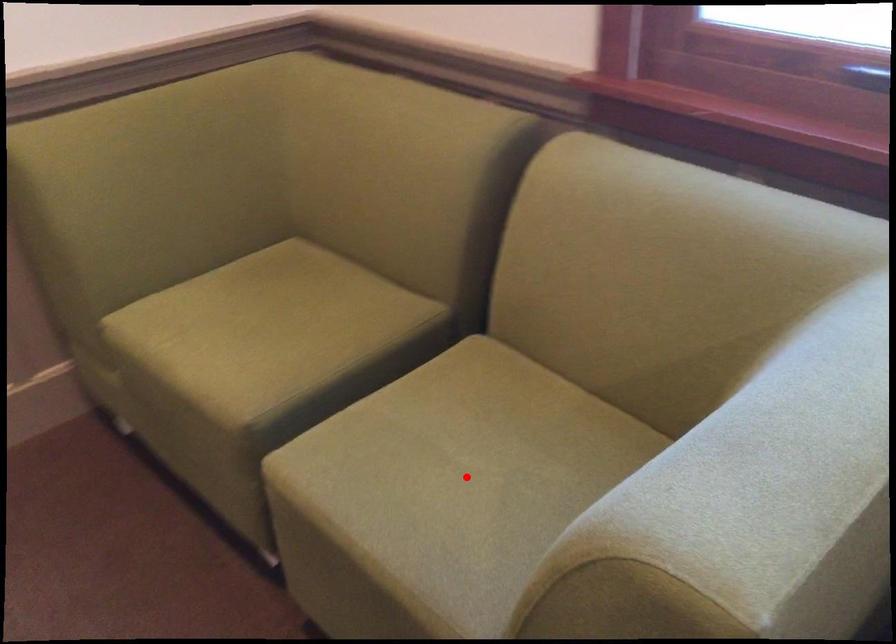
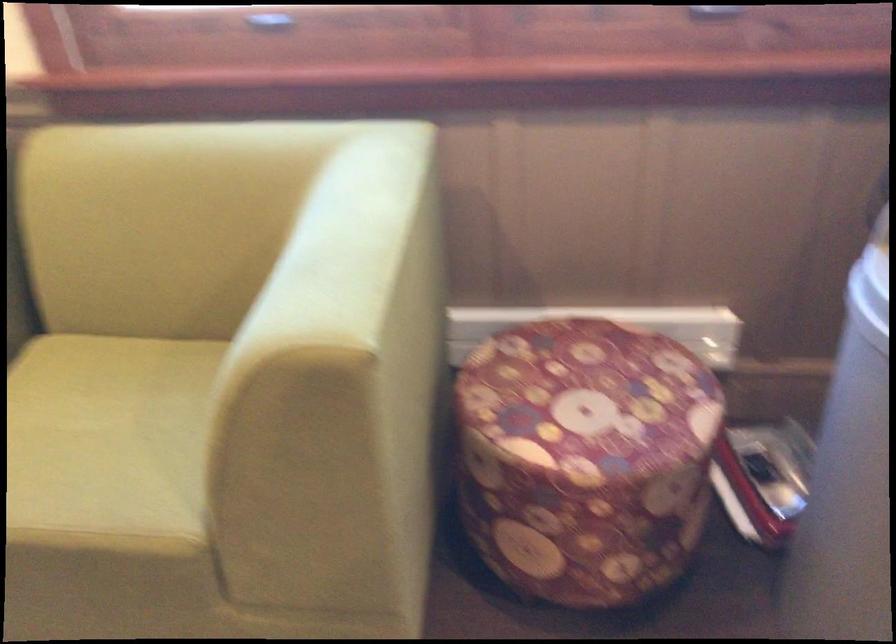
In the second image, find the point that corresponds to the highlighted location in the first image.

(107, 442)